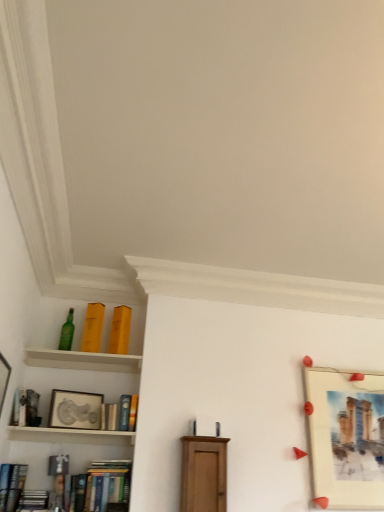
Question: Is matte wood cabinet at center smaller than matte silver picture frame at upper left, placed as the second picture frame when sorted from right to left?

Choices:
 (A) no
 (B) yes

Answer: (A)

Question: Does matte wood cabinet at center have a larger size compared to matte silver picture frame at upper left, which is the 1th picture frame in left-to-right order?

Choices:
 (A) no
 (B) yes

Answer: (B)

Question: From a real-world perspective, does matte wood cabinet at center stand above matte silver picture frame at upper left, which is the 1th picture frame in left-to-right order?

Choices:
 (A) yes
 (B) no

Answer: (B)

Question: Does matte wood cabinet at center appear on the right side of matte silver picture frame at upper left, placed as the second picture frame when sorted from right to left?

Choices:
 (A) no
 (B) yes

Answer: (B)

Question: Does matte wood cabinet at center touch matte silver picture frame at upper left, placed as the second picture frame when sorted from right to left?

Choices:
 (A) yes
 (B) no

Answer: (B)

Question: Is matte wood cabinet at center further to the viewer compared to matte silver picture frame at upper left, which is the 1th picture frame in left-to-right order?

Choices:
 (A) no
 (B) yes

Answer: (A)

Question: Is matte wood cabinet at center bigger than matte paper picture frame at right, marked as the 1th picture frame in a right-to-left arrangement?

Choices:
 (A) yes
 (B) no

Answer: (B)

Question: Is the position of matte wood cabinet at center more distant than that of matte paper picture frame at right, marked as the 1th picture frame in a right-to-left arrangement?

Choices:
 (A) yes
 (B) no

Answer: (B)

Question: Considering the relative sizes of matte wood cabinet at center and matte paper picture frame at right, marked as the 2th picture frame in a left-to-right arrangement, in the image provided, is matte wood cabinet at center taller than matte paper picture frame at right, marked as the 2th picture frame in a left-to-right arrangement,?

Choices:
 (A) no
 (B) yes

Answer: (A)

Question: Considering the relative positions of matte wood cabinet at center and matte paper picture frame at right, marked as the 1th picture frame in a right-to-left arrangement, in the image provided, is matte wood cabinet at center to the left of matte paper picture frame at right, marked as the 1th picture frame in a right-to-left arrangement, from the viewer's perspective?

Choices:
 (A) yes
 (B) no

Answer: (A)

Question: Is matte wood cabinet at center positioned beyond the bounds of matte paper picture frame at right, marked as the 1th picture frame in a right-to-left arrangement?

Choices:
 (A) no
 (B) yes

Answer: (B)

Question: From the image's perspective, does matte wood cabinet at center appear lower than matte paper picture frame at right, marked as the 1th picture frame in a right-to-left arrangement?

Choices:
 (A) yes
 (B) no

Answer: (A)

Question: Considering the relative positions of matte yellow book at upper left, marked as the eighth book in a bottom-to-top arrangement, and hardcover book at lower left, the first book when ordered from bottom to top, in the image provided, is matte yellow book at upper left, marked as the eighth book in a bottom-to-top arrangement, to the left of hardcover book at lower left, the first book when ordered from bottom to top, from the viewer's perspective?

Choices:
 (A) yes
 (B) no

Answer: (B)